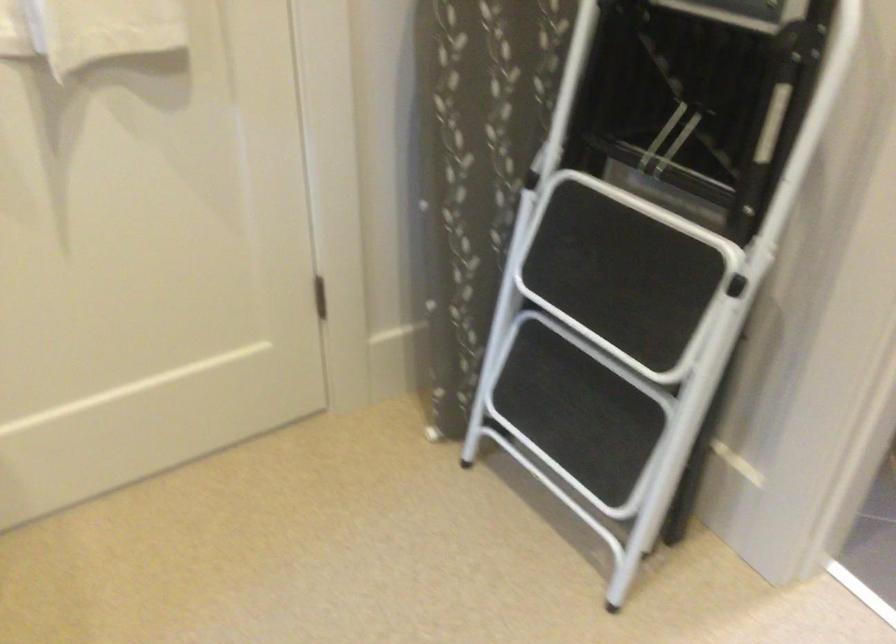
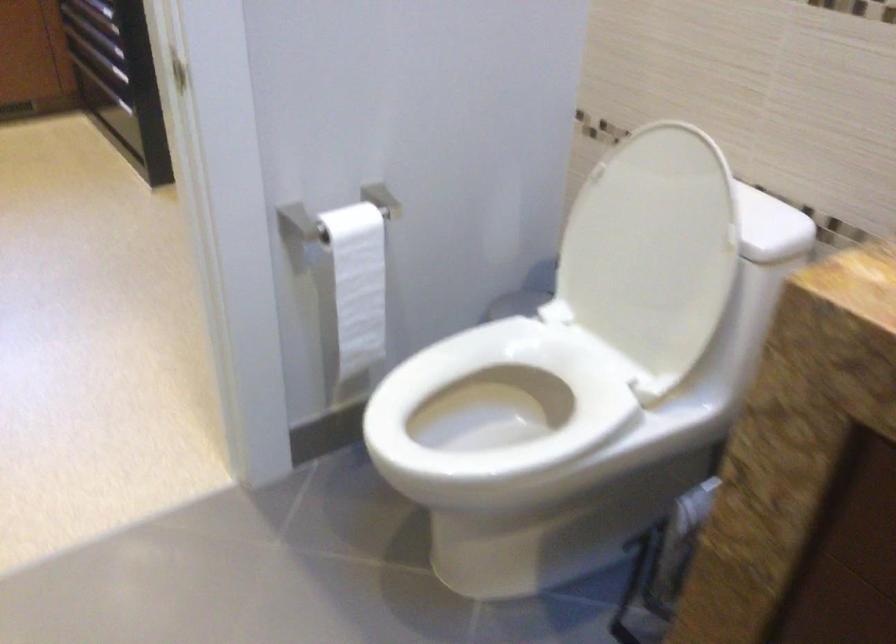
Question: I am providing you with two images of the same scene from different viewpoints. After the viewpoint changes to image2, which objects are now occluded?

Choices:
 (A) black ladder step
 (B) white toilet seat
 (C) folded wooden chair
 (D) white toilet lid

Answer: (A)